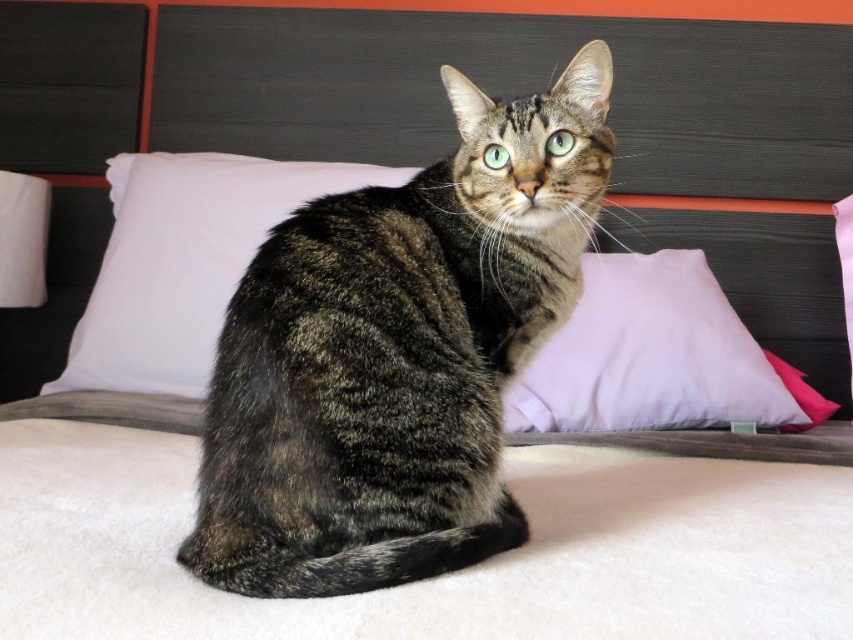
Does white soft pillow at center have a greater height compared to pink fabric pillow at center?

Correct, white soft pillow at center is much taller as pink fabric pillow at center.

Which is more to the right, white soft pillow at center or pink fabric pillow at center?

pink fabric pillow at center is more to the right.

Which is behind, point (120, 380) or point (599, 310)?

The point (120, 380) is behind.

Identify the location of white soft pillow at center. (184, 260).

What do you see at coordinates (397, 353) in the screenshot?
I see `shiny brown fur cat at center` at bounding box center [397, 353].

Is the position of shiny brown fur cat at center more distant than that of white soft pillow at center?

No.

Does point (265, 557) come closer to viewer compared to point (207, 218)?

Yes.

Where is `shiny brown fur cat at center`? The height and width of the screenshot is (640, 853). shiny brown fur cat at center is located at coordinates (397, 353).

Is shiny brown fur cat at center further to the viewer compared to pink fabric pillow at center?

No.

Who is positioned more to the right, shiny brown fur cat at center or pink fabric pillow at center?

pink fabric pillow at center

Find the location of a particular element. Image resolution: width=853 pixels, height=640 pixels. shiny brown fur cat at center is located at coordinates (397, 353).